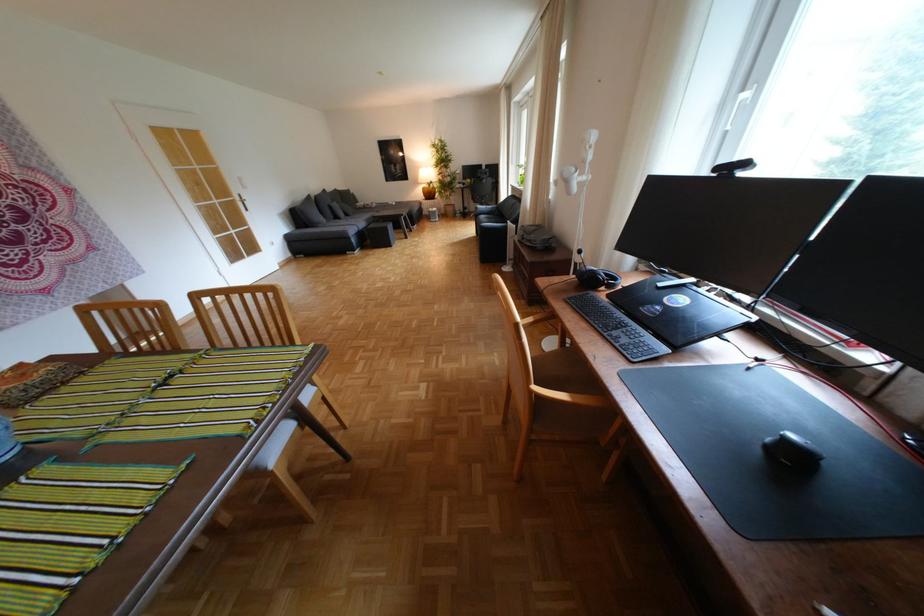
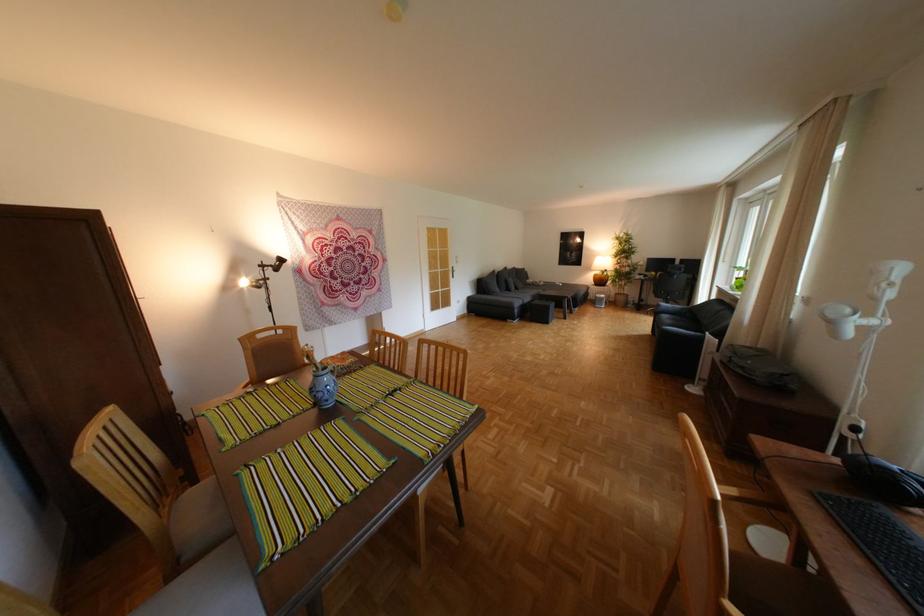
Find the pixel in the second image that matches point 367,241 in the first image.

(529, 312)